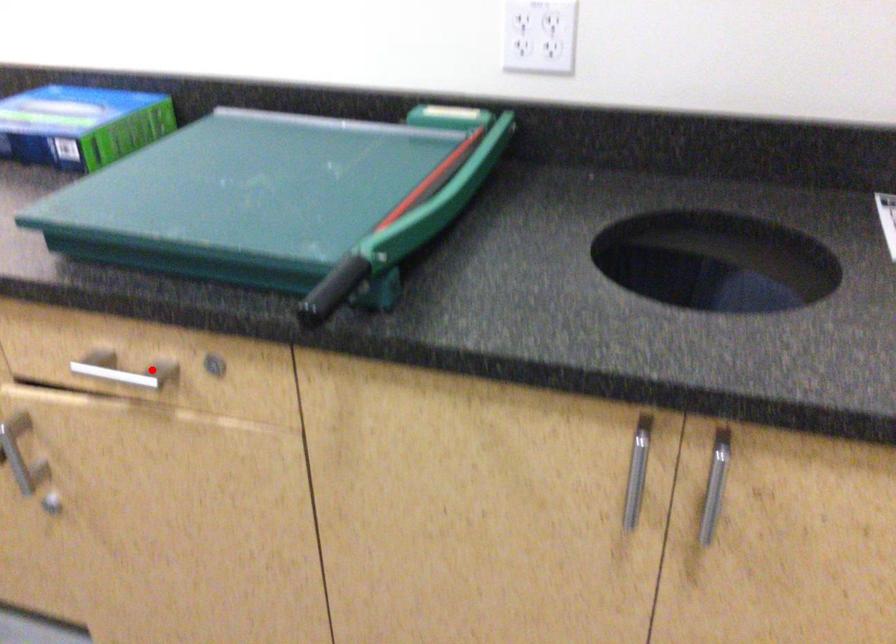
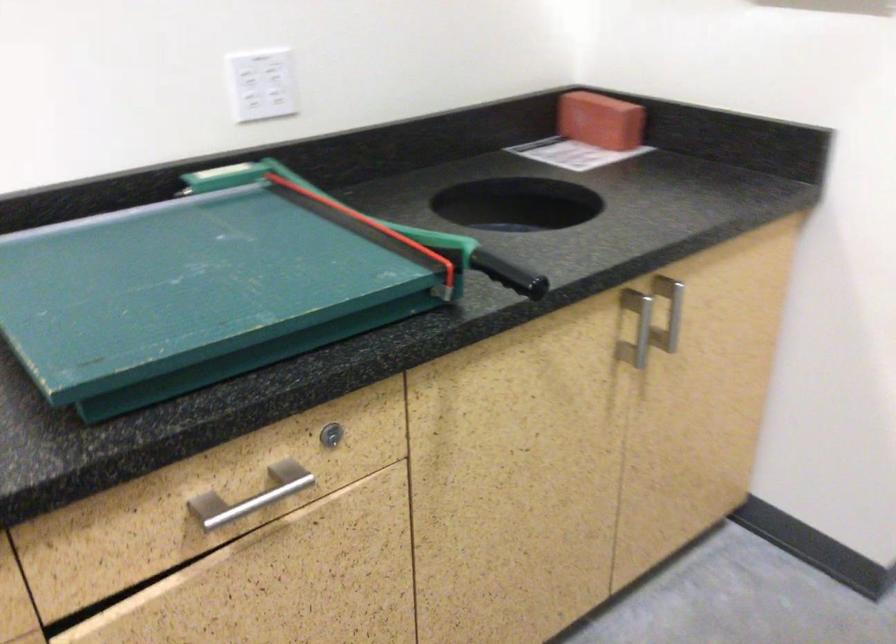
The point at the highlighted location is marked in the first image. Where is the corresponding point in the second image?

(251, 496)